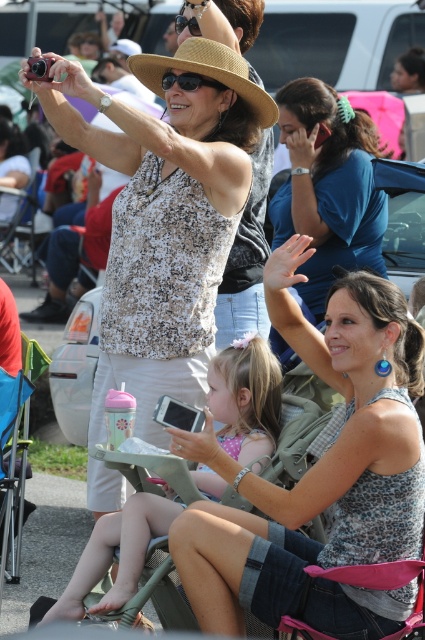
Question: Can you confirm if matte blue shirt at center is smaller than black plastic sunglasses at upper center?

Choices:
 (A) no
 (B) yes

Answer: (A)

Question: Estimate the real-world distances between objects in this image. Which object is farther from the speckled tank top at center?

Choices:
 (A) matte blue shirt at center
 (B) strawmaterial/texturehat at upper center

Answer: (A)

Question: Can you confirm if speckled tank top at center is wider than matte pink phone at center?

Choices:
 (A) no
 (B) yes

Answer: (A)

Question: Which of the following is the farthest from the observer?

Choices:
 (A) matte blue shirt at center
 (B) speckled tank top at center

Answer: (A)

Question: Estimate the real-world distances between objects in this image. Which object is farther from the matte pink phone at center?

Choices:
 (A) strawmaterial/texturehat at upper center
 (B) matte blue shirt at center

Answer: (B)

Question: Is strawmaterial/texturehat at upper center to the right of black plastic sunglasses at upper center from the viewer's perspective?

Choices:
 (A) no
 (B) yes

Answer: (B)